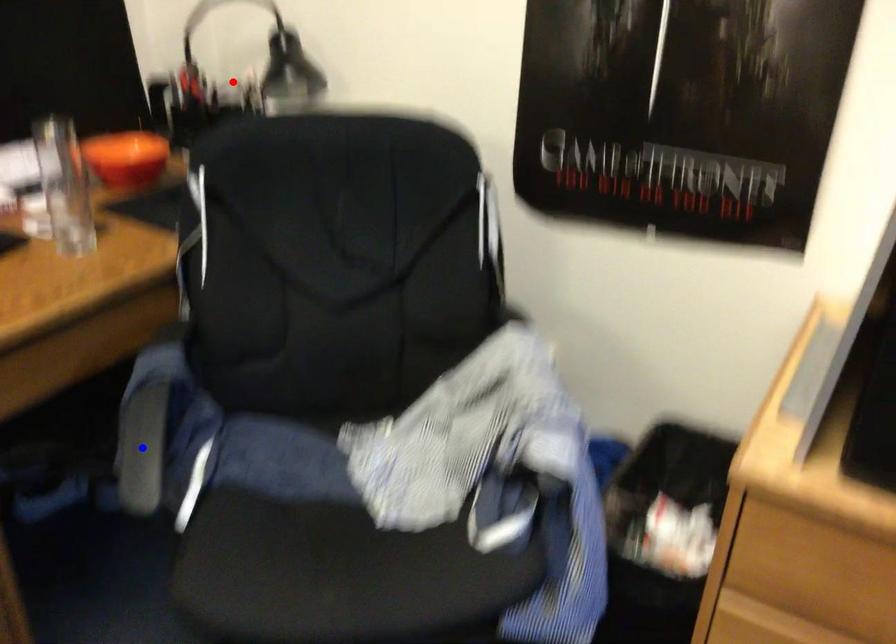
Question: In the image, two points are highlighted. Which point is nearer to the camera? Reply with the corresponding letter.

Choices:
 (A) blue point
 (B) red point

Answer: (A)